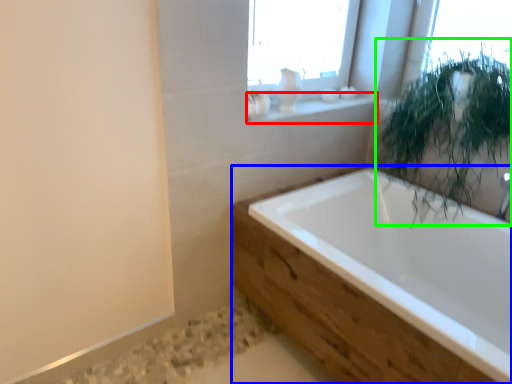
Question: Based on their relative distances, which object is nearer to window sill (highlighted by a red box)? Choose from bathtub (highlighted by a blue box) and vegetation (highlighted by a green box).

Choices:
 (A) bathtub
 (B) vegetation

Answer: (B)